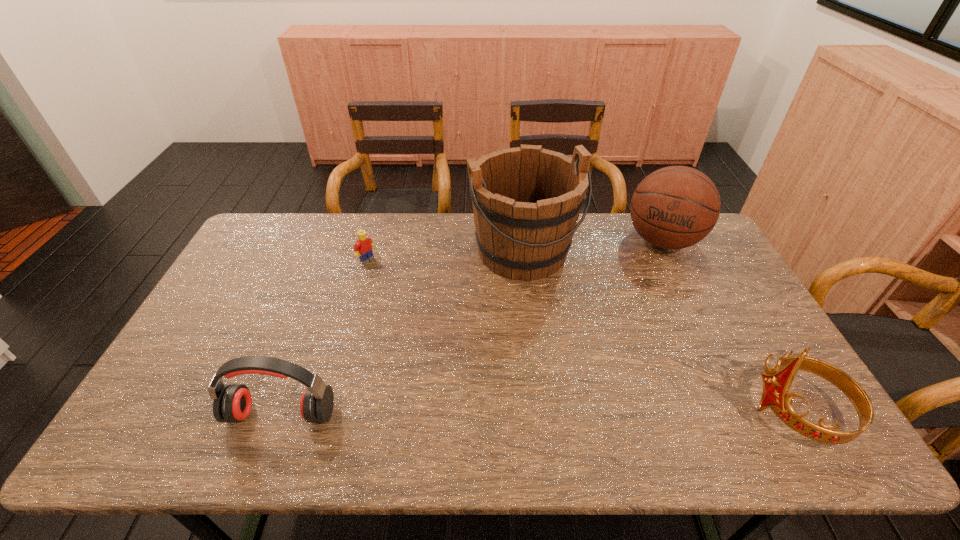
Image resolution: width=960 pixels, height=540 pixels. Identify the location of free space at the far left corner of the desktop. (299, 221).

Locate an element on the screen. This screenshot has width=960, height=540. free space between the second shortest object and the tiara is located at coordinates (540, 413).

Where is `vacant region between the earphone and the Lego`? The height and width of the screenshot is (540, 960). vacant region between the earphone and the Lego is located at coordinates coord(324,337).

Where is `vacant space in between the wine bucket and the tiara`? This screenshot has height=540, width=960. vacant space in between the wine bucket and the tiara is located at coordinates (660, 332).

Identify the location of vacant space in between the tiara and the fourth tallest object. The height and width of the screenshot is (540, 960). (540, 413).

Locate an element on the screen. The width and height of the screenshot is (960, 540). free spot between the basketball and the wine bucket is located at coordinates (593, 246).

What are the coordinates of `vacant space in between the fourth tallest object and the basketball` in the screenshot? It's located at (472, 327).

I want to click on unoccupied area between the basketball and the third object from right to left, so click(x=593, y=246).

Where is `blank region between the Lego and the fourth tallest object`? Image resolution: width=960 pixels, height=540 pixels. blank region between the Lego and the fourth tallest object is located at coordinates (324, 337).

Find the location of a particular element. The image size is (960, 540). object that can be found as the closest to the fourth tallest object is located at coordinates (363, 247).